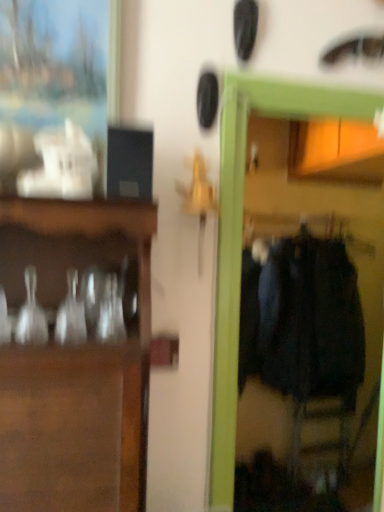
Question: Is clear glass vase at left not near dark blue fabric coat at right?

Choices:
 (A) yes
 (B) no

Answer: (A)

Question: Is clear glass vase at left located outside dark blue fabric coat at right?

Choices:
 (A) yes
 (B) no

Answer: (A)

Question: Can you confirm if clear glass vase at left is shorter than dark blue fabric coat at right?

Choices:
 (A) no
 (B) yes

Answer: (B)

Question: Is clear glass vase at left with dark blue fabric coat at right?

Choices:
 (A) yes
 (B) no

Answer: (B)

Question: From a real-world perspective, does clear glass vase at left sit lower than dark blue fabric coat at right?

Choices:
 (A) yes
 (B) no

Answer: (B)

Question: From the image's perspective, would you say clear glass vase at left is shown under dark blue fabric coat at right?

Choices:
 (A) no
 (B) yes

Answer: (A)

Question: Is dark blue fabric coat at right smaller than clear glass vase at left?

Choices:
 (A) yes
 (B) no

Answer: (B)

Question: Does dark blue fabric coat at right turn towards clear glass vase at left?

Choices:
 (A) no
 (B) yes

Answer: (A)

Question: Is dark blue fabric coat at right shorter than clear glass vase at left?

Choices:
 (A) yes
 (B) no

Answer: (B)

Question: From a real-world perspective, is dark blue fabric coat at right on top of clear glass vase at left?

Choices:
 (A) no
 (B) yes

Answer: (A)

Question: Are dark blue fabric coat at right and clear glass vase at left making contact?

Choices:
 (A) yes
 (B) no

Answer: (B)

Question: From the image's perspective, is dark blue fabric coat at right below clear glass vase at left?

Choices:
 (A) yes
 (B) no

Answer: (A)

Question: Considering the positions of point (322, 331) and point (29, 267), is point (322, 331) closer or farther from the camera than point (29, 267)?

Choices:
 (A) farther
 (B) closer

Answer: (A)